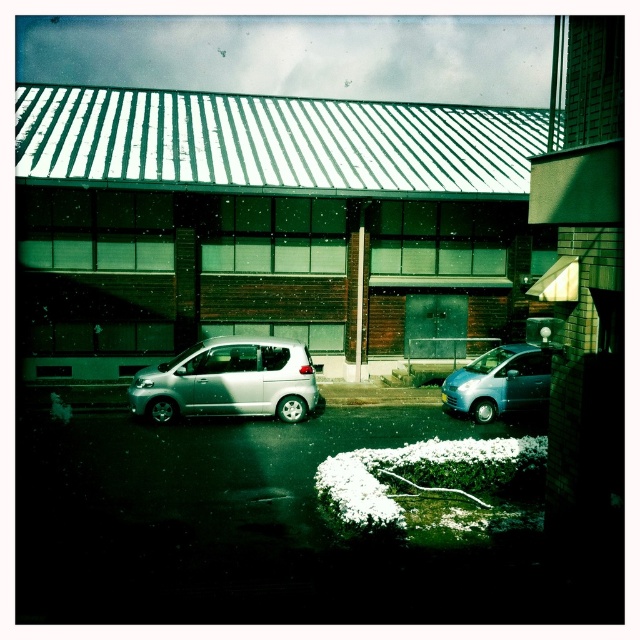
Does point (168, 384) come in front of point (528, 406)?

Yes, it is in front of point (528, 406).

Between satin silver car at center and satin silver van at center, which one is positioned lower?

satin silver van at center

Is point (202, 404) positioned in front of point (524, 369)?

Yes, it is.

At what (x,y) coordinates should I click in order to perform the action: click on satin silver car at center. Please return your answer as a coordinate pair (x, y). Looking at the image, I should click on (228, 381).